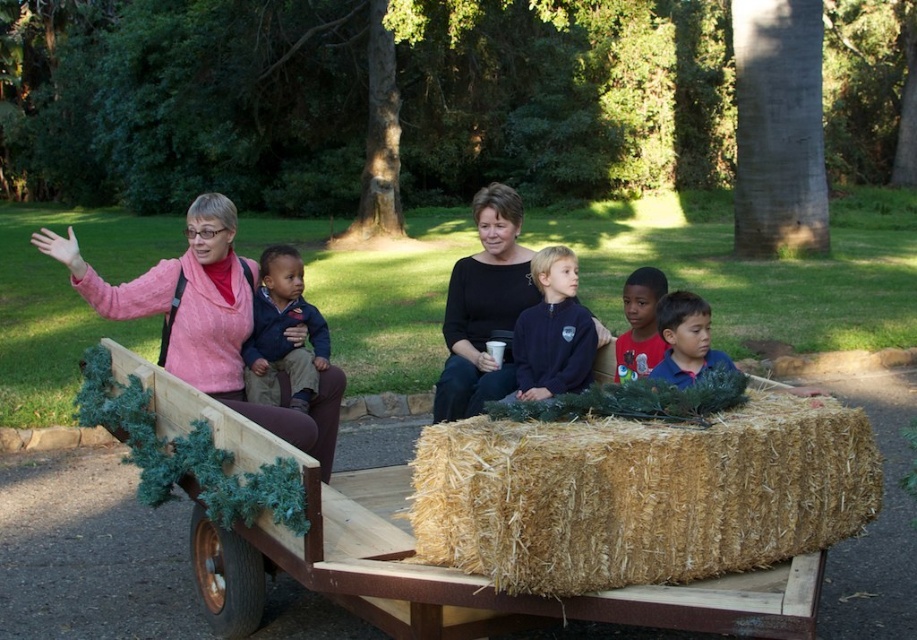
What do you see at coordinates (369, 532) in the screenshot? I see `wooden wagon at center` at bounding box center [369, 532].

Who is more distant from viewer, (326, 538) or (258, 289)?

Positioned behind is point (258, 289).

Where is `wooden wagon at center`? The image size is (917, 640). wooden wagon at center is located at coordinates (369, 532).

Can you confirm if black matte sweater at center is bigger than blue shirt at center?

No, black matte sweater at center is not bigger than blue shirt at center.

Between black matte sweater at center and blue shirt at center, which one has less height?

With less height is black matte sweater at center.

Who is more distant from viewer, (453, 381) or (687, 291)?

The point (687, 291) is more distant.

Image resolution: width=917 pixels, height=640 pixels. Identify the location of black matte sweater at center. (484, 307).

Is bleached straw bale at center taller than smooth blue shirt at center?

Yes.

Between point (448, 472) and point (637, 275), which one is positioned in front?

Point (448, 472)

Is point (579, 488) farther from viewer compared to point (634, 362)?

No, it is not.

Where is `bleached straw bale at center`? This screenshot has height=640, width=917. bleached straw bale at center is located at coordinates (641, 493).